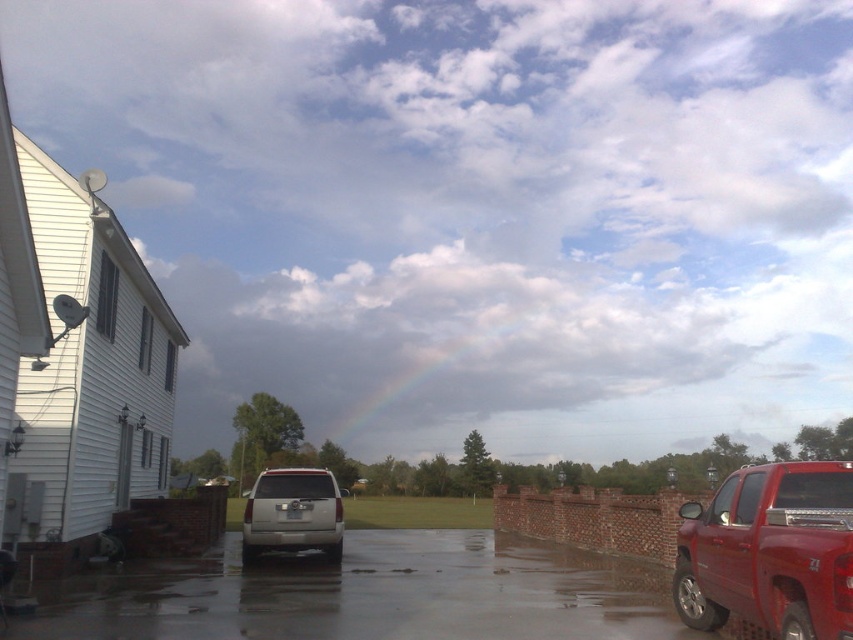
Question: Can you confirm if glossy asphalt driveway at center is positioned to the left of glossy red truck at right?

Choices:
 (A) no
 (B) yes

Answer: (B)

Question: Can you confirm if glossy asphalt driveway at center is smaller than satin silver suv at center?

Choices:
 (A) no
 (B) yes

Answer: (B)

Question: Estimate the real-world distances between objects in this image. Which object is closer to the satin silver suv at center?

Choices:
 (A) glossy red truck at right
 (B) glossy asphalt driveway at center

Answer: (B)

Question: Does glossy asphalt driveway at center have a greater width compared to glossy red truck at right?

Choices:
 (A) no
 (B) yes

Answer: (B)

Question: Among these objects, which one is nearest to the camera?

Choices:
 (A) glossy red truck at right
 (B) glossy asphalt driveway at center
 (C) satin silver suv at center

Answer: (A)

Question: Which point appears closest to the camera in this image?

Choices:
 (A) (828, 636)
 (B) (189, 598)

Answer: (A)